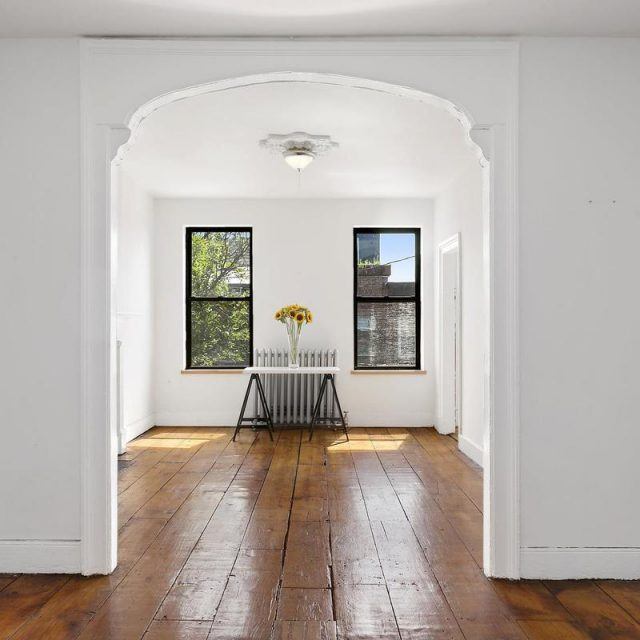
Where is `clear vase`? This screenshot has height=640, width=640. clear vase is located at coordinates coord(291,335).